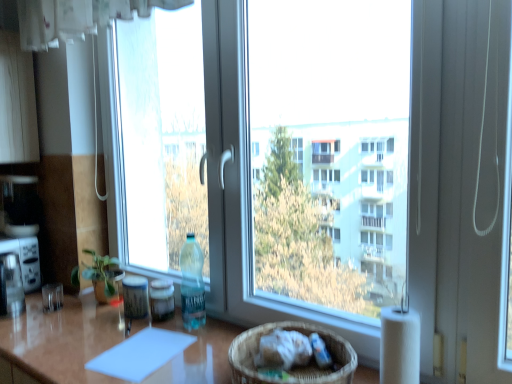
Find the location of a particular element. The image size is (512, 384). free space in front of translucent plastic bottle at center is located at coordinates (151, 336).